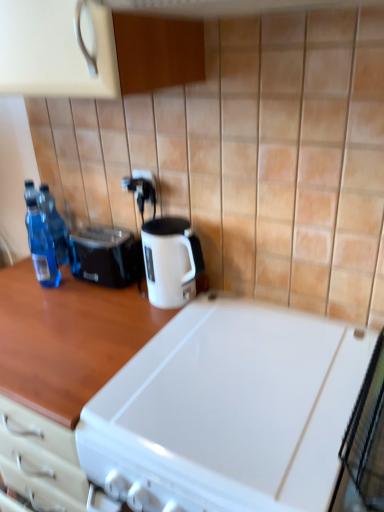
You are a GUI agent. You are given a task and a screenshot of the screen. Output one action in this format:
    pyautogui.click(x=<x>, y=<y>)
    Task: Click on the free space to the left of white glossy electric kettle at center
    The height and width of the screenshot is (512, 384).
    Given the screenshot: What is the action you would take?
    pyautogui.click(x=117, y=307)